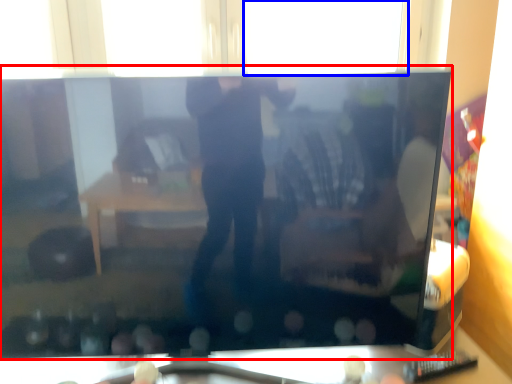
Question: Which object appears closest to the camera in this image, television (highlighted by a red box) or window (highlighted by a blue box)?

Choices:
 (A) television
 (B) window

Answer: (A)